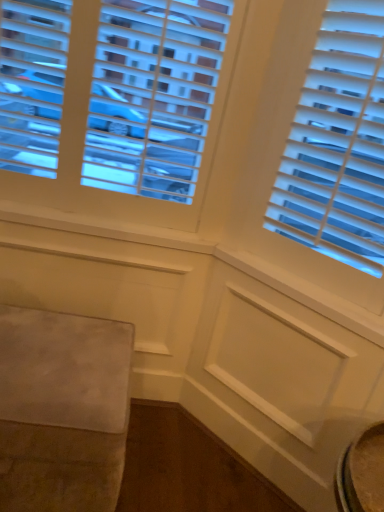
This screenshot has width=384, height=512. Describe the element at coordinates (62, 410) in the screenshot. I see `suede-like beige ottoman at lower left` at that location.

In order to click on suede-like beige ottoman at lower left in this screenshot , I will do `click(62, 410)`.

Measure the distance between point (69, 425) and camera.

Point (69, 425) is 1.00 meters from camera.

Locate an element on the screen. The height and width of the screenshot is (512, 384). suede-like beige ottoman at lower left is located at coordinates (62, 410).